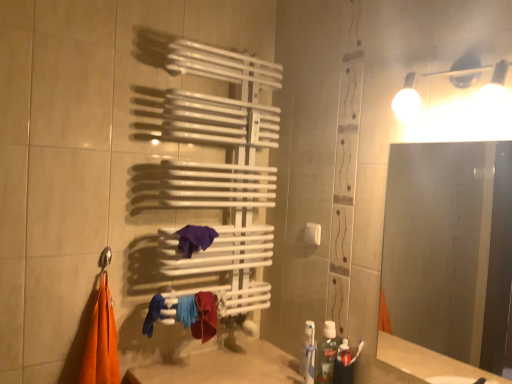
Question: Visually, is translucent plastic toothpaste at lower right positioned to the left or to the right of blue fabric at lower center?

Choices:
 (A) left
 (B) right

Answer: (B)

Question: Looking at the image, does translucent plastic toothpaste at lower right seem bigger or smaller compared to blue fabric at lower center?

Choices:
 (A) small
 (B) big

Answer: (A)

Question: Which of these objects is positioned farthest from the blue fabric at lower center?

Choices:
 (A) frosted glass mirror at right
 (B) purple fabric towel at center
 (C) translucent plastic toothpaste at lower right
 (D) white plastic towel bar at center

Answer: (A)

Question: Which object is positioned closest to the translucent plastic toothpaste at lower right?

Choices:
 (A) purple fabric towel at center
 (B) frosted glass mirror at right
 (C) white plastic towel bar at center
 (D) blue fabric at lower center

Answer: (C)